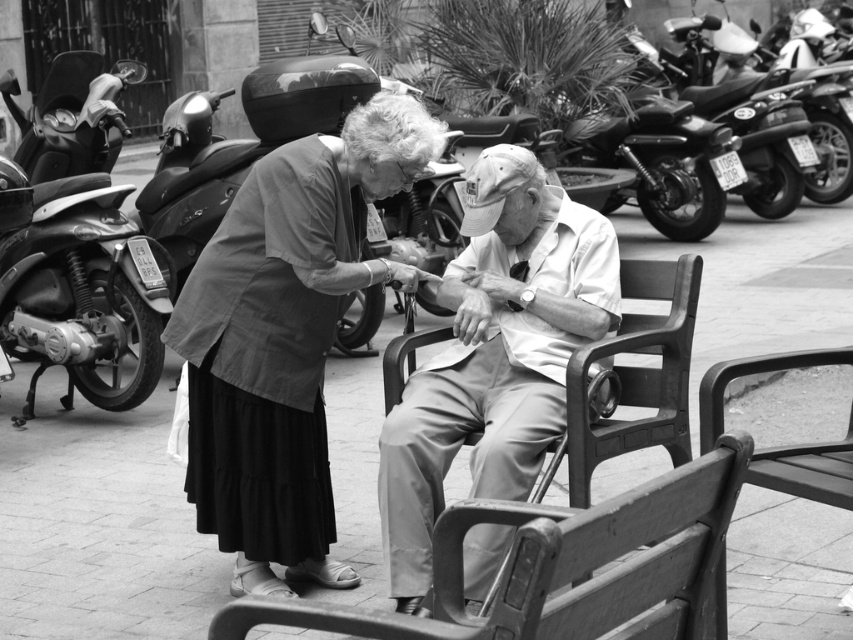
Question: Considering the real-world distances, which object is farthest from the metallic silver motorcycle at upper right?

Choices:
 (A) light brown wooden bench at center
 (B) smooth beige pants at center

Answer: (A)

Question: Which point is closer to the camera taking this photo?

Choices:
 (A) (439, 432)
 (B) (582, 330)
 (C) (746, 106)

Answer: (A)

Question: Based on their relative distances, which object is farther from the light brown wooden bench at center?

Choices:
 (A) shiny black motorcycle at left
 (B) smooth beige pants at center
 (C) metallic silver motorcycle at upper right

Answer: (C)

Question: Does smooth beige pants at center appear on the right side of metallic silver motorcycle at upper right?

Choices:
 (A) no
 (B) yes

Answer: (A)

Question: In this image, where is shiny black motorcycle at left located relative to metallic silver motorcycle at upper right?

Choices:
 (A) right
 (B) left

Answer: (B)

Question: Is smooth beige pants at center thinner than shiny black motorcycle at left?

Choices:
 (A) yes
 (B) no

Answer: (A)